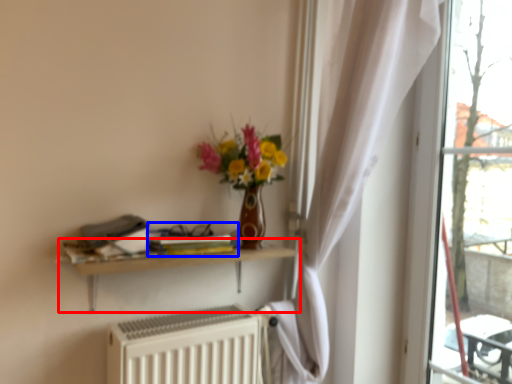
Question: Which point is closer to the camera, shelf (highlighted by a red box) or book (highlighted by a blue box)?

Choices:
 (A) shelf
 (B) book

Answer: (A)